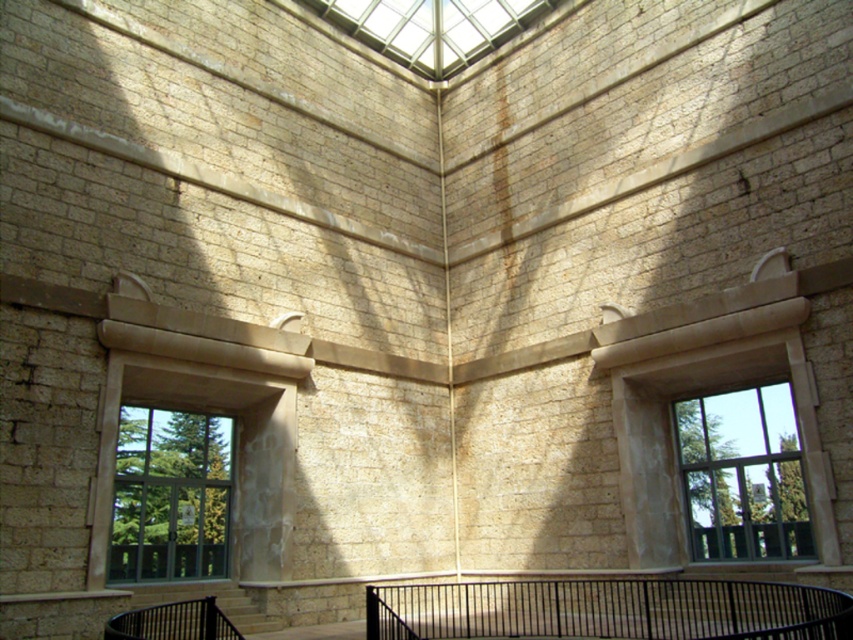
Question: Considering the relative positions of clear glass window at right and clear glass window at left in the image provided, where is clear glass window at right located with respect to clear glass window at left?

Choices:
 (A) below
 (B) above

Answer: (B)

Question: Considering the relative positions of clear glass window at right and transparent glass skylight at upper center in the image provided, where is clear glass window at right located with respect to transparent glass skylight at upper center?

Choices:
 (A) below
 (B) above

Answer: (A)

Question: Which point appears closest to the camera in this image?

Choices:
 (A) (225, 424)
 (B) (467, 26)
 (C) (693, 428)

Answer: (A)

Question: Which of the following is the closest to the observer?

Choices:
 (A) clear glass window at right
 (B) clear glass window at left
 (C) black metal balustrade at lower center

Answer: (C)

Question: Does clear glass window at right appear under transparent glass skylight at upper center?

Choices:
 (A) no
 (B) yes

Answer: (B)

Question: Which point appears closest to the camera in this image?

Choices:
 (A) (672, 593)
 (B) (120, 488)

Answer: (B)